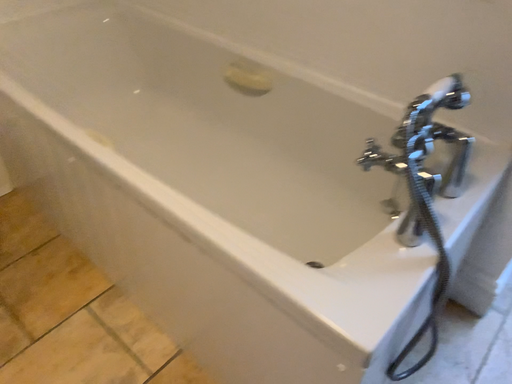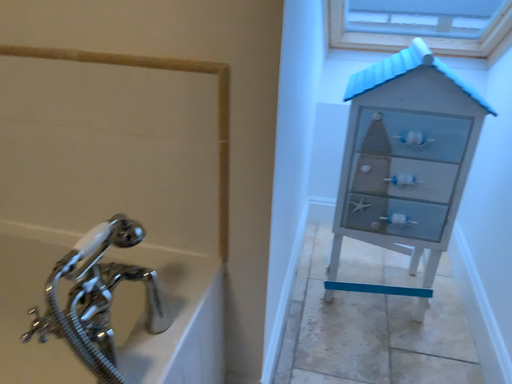
Question: How did the camera likely rotate when shooting the video?

Choices:
 (A) rotated upward
 (B) rotated downward

Answer: (A)